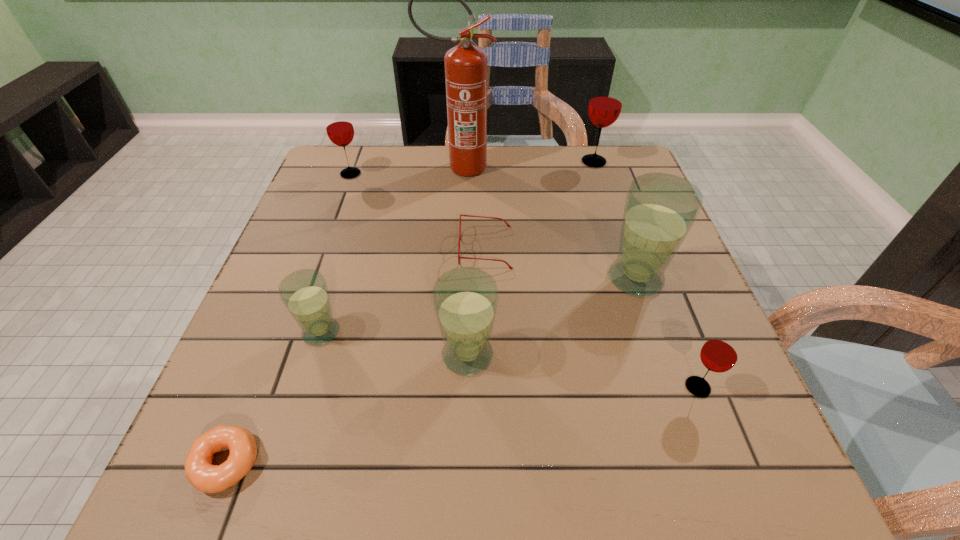
Locate an element on the screen. free region located 0.320m on the back of the nearest red glass is located at coordinates (646, 252).

Identify the location of free region located 0.280m on the face of the spectacles. This screenshot has height=540, width=960. (338, 248).

Image resolution: width=960 pixels, height=540 pixels. Find the location of `free spot located on the face of the spectacles`. free spot located on the face of the spectacles is located at coordinates (372, 248).

I want to click on vacant space positioned 0.110m on the face of the spectacles, so click(x=412, y=248).

Find the location of a particular element. Image resolution: width=960 pixels, height=540 pixels. vacant space positioned 0.290m on the right of the nearest object is located at coordinates (447, 463).

Image resolution: width=960 pixels, height=540 pixels. In order to click on fire extinguisher present at the far edge in this screenshot , I will do `click(466, 65)`.

Locate an element on the screen. object situated at the near edge is located at coordinates (207, 478).

Identify the location of doughnut present at the left edge. The image size is (960, 540). click(207, 478).

Where is `object present at the far left corner`? Image resolution: width=960 pixels, height=540 pixels. object present at the far left corner is located at coordinates (339, 127).

The height and width of the screenshot is (540, 960). What are the coordinates of `object that is at the near left corner` in the screenshot? It's located at (207, 478).